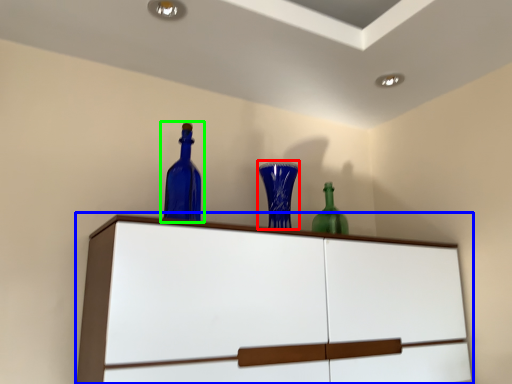
Question: Estimate the real-world distances between objects in this image. Which object is farther from glass vase (highlighted by a red box), cupboard (highlighted by a blue box) or bottle (highlighted by a green box)?

Choices:
 (A) cupboard
 (B) bottle

Answer: (A)